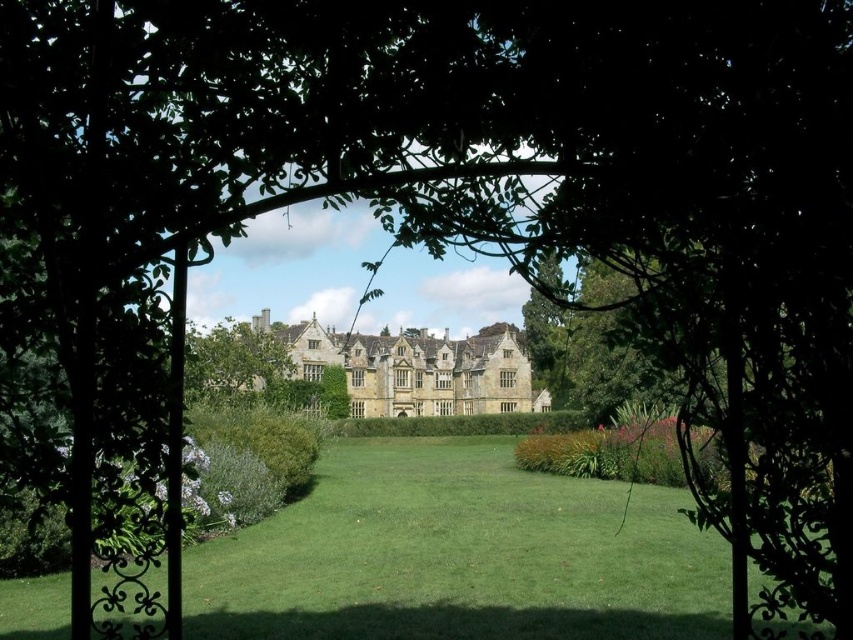
Is green grass at center above green leafy tree at center?

No.

From the picture: Does green grass at center lie in front of green leafy tree at center?

No, green grass at center is further to the viewer.

Between point (459, 483) and point (223, 374), which one is positioned in front?

Point (223, 374) is in front.

Locate an element on the screen. The width and height of the screenshot is (853, 640). green grass at center is located at coordinates (460, 556).